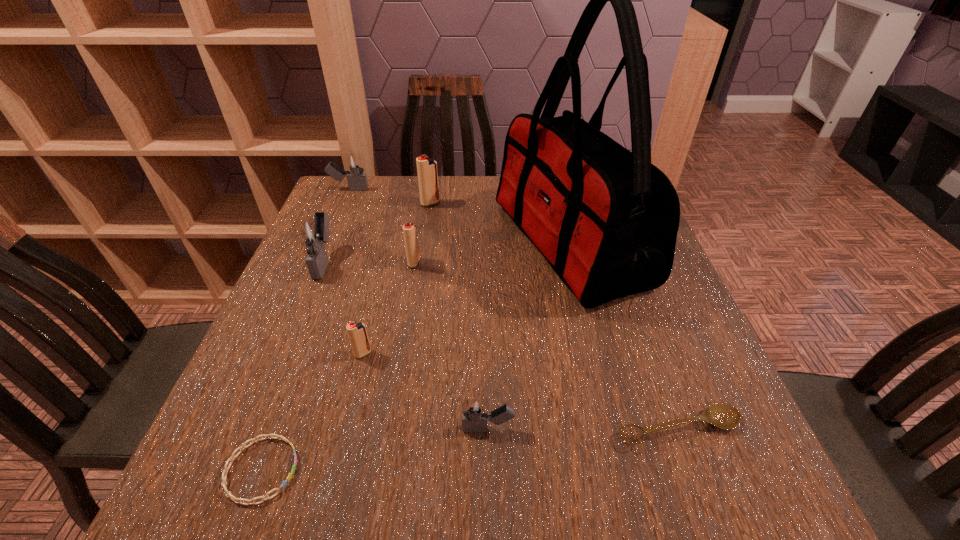
The width and height of the screenshot is (960, 540). What are the coordinates of `empty location between the second nearest red igniter and the farthest igniter` in the screenshot? It's located at (381, 226).

Locate an element on the screen. free spot between the nearest igniter and the second biggest red igniter is located at coordinates (451, 346).

The width and height of the screenshot is (960, 540). In order to click on free spot between the nearest gray igniter and the fifth farthest igniter in this screenshot , I will do `click(425, 392)`.

At what (x,y) coordinates should I click in order to perform the action: click on unoccupied area between the bracelet and the second smallest red igniter. Please return your answer as a coordinate pair (x, y). This screenshot has height=540, width=960. Looking at the image, I should click on (338, 366).

In order to click on vacant region between the duffel bag and the nearest gray igniter in this screenshot , I will do `click(529, 337)`.

At what (x,y) coordinates should I click in order to perform the action: click on empty space that is in between the biggest gray igniter and the duffel bag. Please return your answer as a coordinate pair (x, y). This screenshot has width=960, height=540. Looking at the image, I should click on point(447,253).

The image size is (960, 540). Find the location of `free spot between the fourth nearest object and the farthest red igniter`. free spot between the fourth nearest object and the farthest red igniter is located at coordinates (396, 279).

Where is `vacant space that is in between the shortest object and the second nearest gray igniter`? vacant space that is in between the shortest object and the second nearest gray igniter is located at coordinates (294, 366).

At what (x,y) coordinates should I click in order to perform the action: click on object that is the closest to the second farthest gray igniter. Please return your answer as a coordinate pair (x, y). Image resolution: width=960 pixels, height=540 pixels. Looking at the image, I should click on (409, 229).

Locate which object ranks eighth in proximity to the second biggest red igniter. Please provide its 2D coordinates. Your answer should be formatted as a tuple, i.e. [(x, y)], where the tuple contains the x and y coordinates of a point satisfying the conditions above.

[(724, 416)]